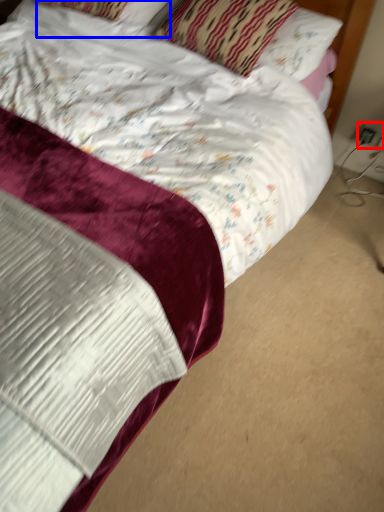
Question: Which object appears closest to the camera in this image, electric outlet (highlighted by a red box) or pillow (highlighted by a blue box)?

Choices:
 (A) electric outlet
 (B) pillow

Answer: (B)